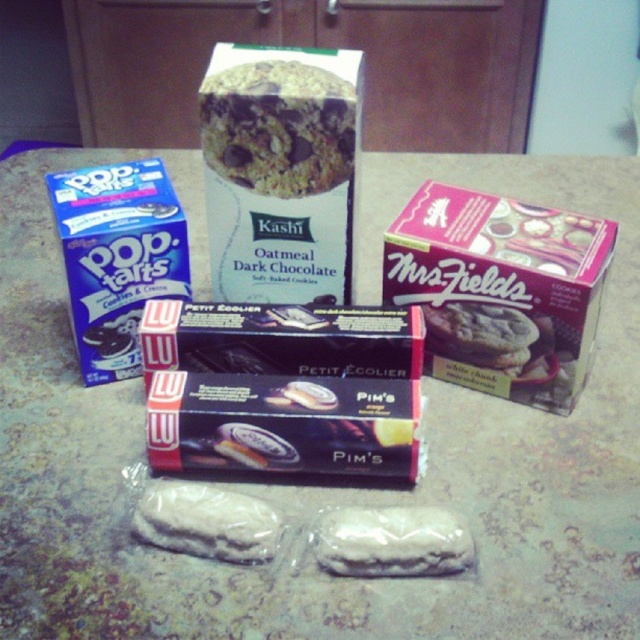
Question: Considering the real-world distances, which object is farthest from the blue matte pop-tarts at left?

Choices:
 (A) pink matte mrsfields cookies at upper right
 (B) white matte cookie at center

Answer: (B)

Question: Is blue matte pop-tarts at left positioned at the back of white matte cookie at center?

Choices:
 (A) no
 (B) yes

Answer: (B)

Question: Is pink matte mrsfields cookies at upper right thinner than blue matte pop-tarts at left?

Choices:
 (A) yes
 (B) no

Answer: (B)

Question: Based on their relative distances, which object is farther from the white matte cookie at center?

Choices:
 (A) pink matte mrsfields cookies at upper right
 (B) blue matte pop-tarts at left

Answer: (B)

Question: Which point is closer to the camera?

Choices:
 (A) (424, 522)
 (B) (484, 330)

Answer: (A)

Question: Does pink matte mrsfields cookies at upper right have a greater width compared to white matte cookie at center?

Choices:
 (A) yes
 (B) no

Answer: (A)